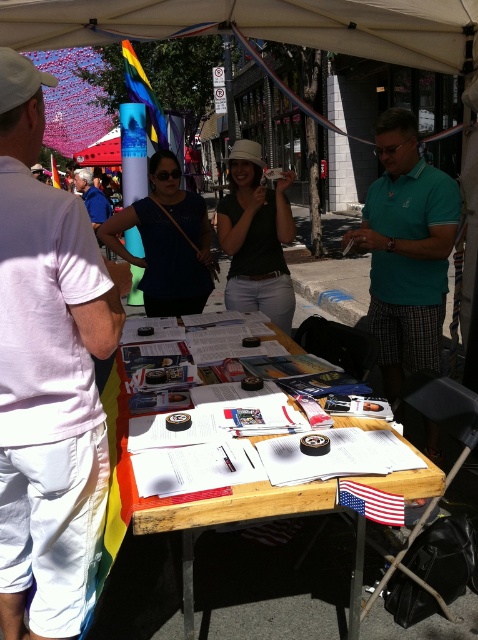
You are standing at the entrance of the white canopy tent and want to locate the matte black shirt at center and the rainbow fabric flag at upper left. Based on their positions, which object is closer to the ground?

The matte black shirt at center is closer to the ground because it is below the rainbow fabric flag at upper left.

You are at the event and want to place a small item on the table between the matte black shirt at center and the american flag at center. Is there enough space between them for the item?

The matte black shirt at center is located above the american flag at center, so there is vertical space between them. However, since both are at the center, placing an item between them might require checking horizontal positioning as the description only mentions vertical placement.

You are standing at the entrance of the white canopy tent and want to know which object is shorter between the matte black shirt at center and the rainbow fabric flag at upper left. Can you tell me?

The matte black shirt at center has a lesser height compared to the rainbow fabric flag at upper left, so the matte black shirt at center is shorter.